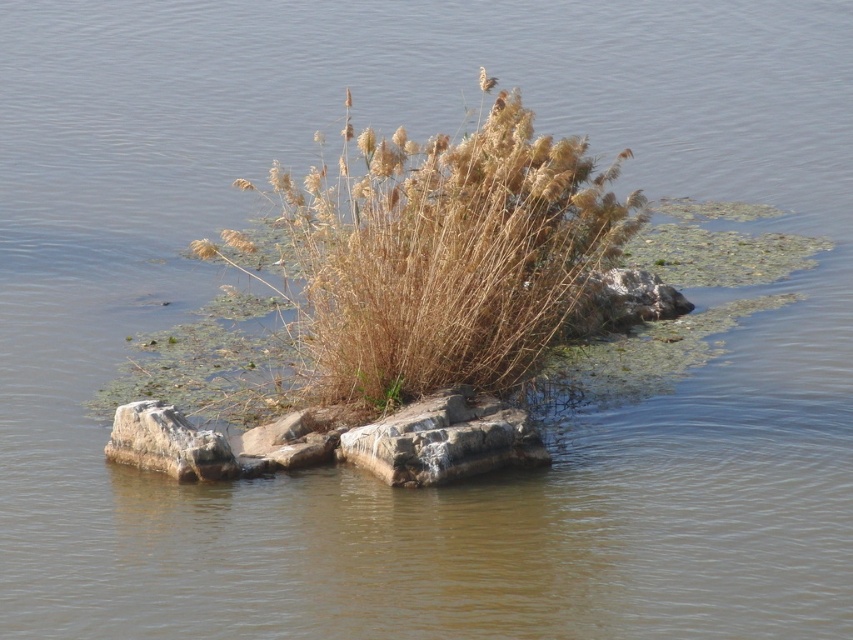
Question: Which point is closer to the camera?

Choices:
 (A) gray/weathered stone at center
 (B) gray rock at center
 (C) dry grass at center

Answer: (C)

Question: Is gray/weathered stone at center closer to the viewer compared to gray/rocky stone at lower left?

Choices:
 (A) no
 (B) yes

Answer: (B)

Question: Estimate the real-world distances between objects in this image. Which object is closer to the gray/weathered stone at center?

Choices:
 (A) gray rock at center
 (B) gray/rocky stone at lower left

Answer: (B)

Question: Which point is closer to the camera taking this photo?

Choices:
 (A) (450, 221)
 (B) (480, 468)

Answer: (A)

Question: Does dry grass at center come behind gray/weathered stone at center?

Choices:
 (A) yes
 (B) no

Answer: (B)

Question: Considering the relative positions of dry grass at center and gray rock at center in the image provided, where is dry grass at center located with respect to gray rock at center?

Choices:
 (A) above
 (B) below

Answer: (A)